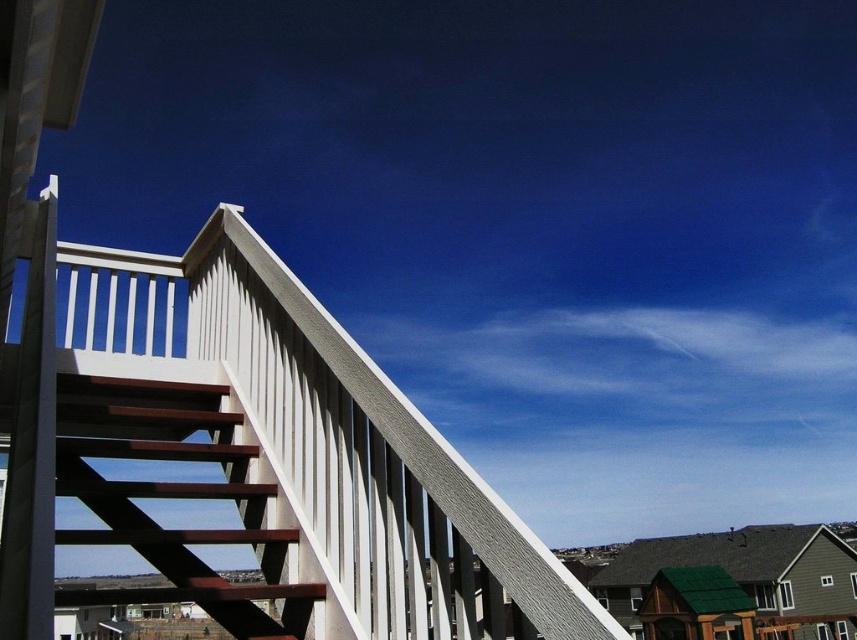
You are standing at the base of the diagonal wooden staircase with white balusters and dark wooden steps. You want to walk towards the white textured porch at upper left located at point (252, 460). Which direction should you move relative to the staircase?

You should move towards the upper left direction relative to the staircase to reach the white textured porch at upper left located at point (252, 460).

You are a delivery person carrying a package that is 1.5 meters long. You need to move it through the space between the white textured porch at upper left and the staircase. Will the package fit through the space?

The space between the white textured porch at upper left and the staircase is 1.35 meters. Since the package is 1.5 meters long, it is 0.15 meters too long to fit through the space.

You are standing at the base of the brown wooden stairs at upper left and want to reach the white textured porch at upper left. Which direction should you move relative to the stairs to get there?

To reach the white textured porch at upper left from the brown wooden stairs at upper left, you should move to the right since the white textured porch at upper left is located to the right of the brown wooden stairs at upper left.